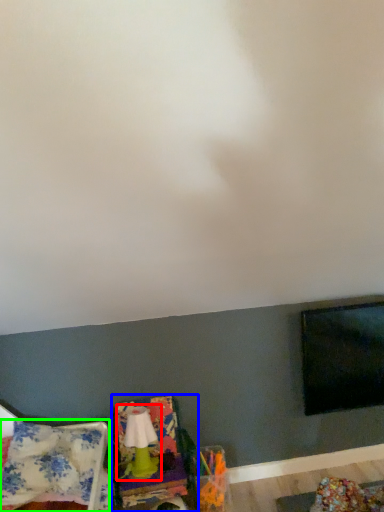
Question: Considering the real-world distances, which object is closest to lamp (highlighted by a red box)? swivel chair (highlighted by a blue box) or blanket (highlighted by a green box).

Choices:
 (A) swivel chair
 (B) blanket

Answer: (A)